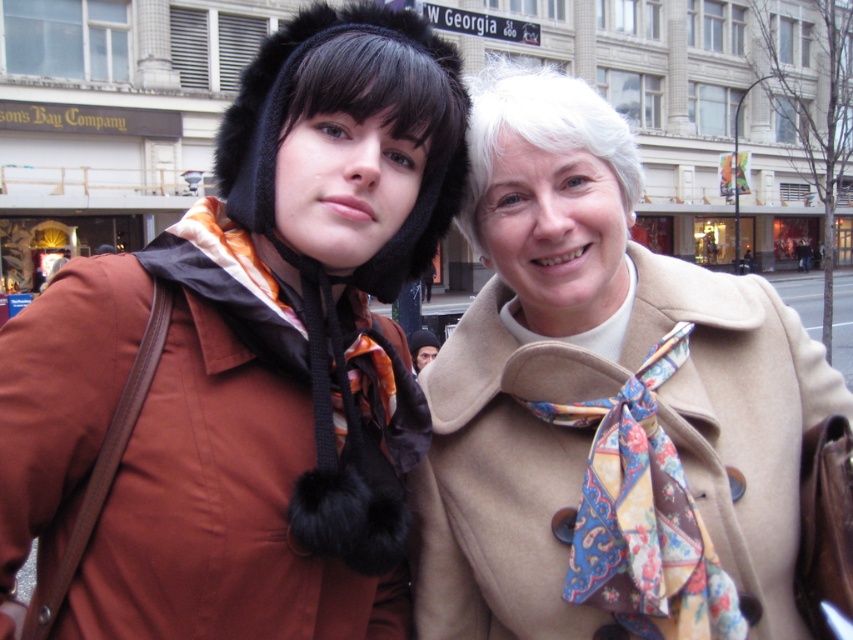
Question: Which object is the closest to the fuzzy black hat at center?

Choices:
 (A) dark brown leather jacket at center
 (B) beige woolen coat at right

Answer: (B)

Question: Observing the image, what is the correct spatial positioning of white plastic street sign at upper center in reference to dark brown leather jacket at center?

Choices:
 (A) right
 (B) left

Answer: (A)

Question: Is beige woolen coat at right closer to camera compared to paisley silk scarf at center?

Choices:
 (A) no
 (B) yes

Answer: (A)

Question: Which of the following is the closest to the observer?

Choices:
 (A) (486, 29)
 (B) (566, 435)
 (C) (438, 340)
 (D) (396, 403)

Answer: (B)

Question: Does paisley silk scarf at center have a larger size compared to dark brown leather jacket at center?

Choices:
 (A) yes
 (B) no

Answer: (A)

Question: Estimate the real-world distances between objects in this image. Which object is closer to the beige woolen coat at right?

Choices:
 (A) dark brown leather jacket at center
 (B) orange printed fabric scarf at left

Answer: (B)